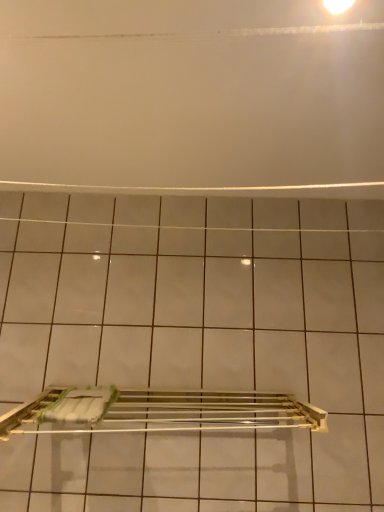
Find the location of a particular element. The width and height of the screenshot is (384, 512). metallic silver towel rack at lower center is located at coordinates (157, 412).

Consider the image. Measure the distance between metallic silver towel rack at lower center and camera.

The distance of metallic silver towel rack at lower center from camera is 35.12 inches.

This screenshot has width=384, height=512. What do you see at coordinates (157, 412) in the screenshot? I see `metallic silver towel rack at lower center` at bounding box center [157, 412].

Locate an element on the screen. metallic silver towel rack at lower center is located at coordinates (157, 412).